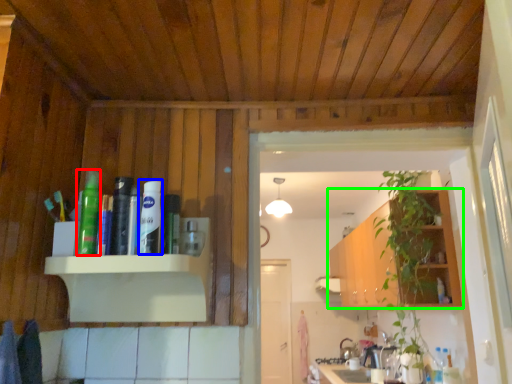
Question: Estimate the real-world distances between objects in this image. Which object is farther from toiletry (highlighted by a red box), toiletry (highlighted by a blue box) or cabinetry (highlighted by a green box)?

Choices:
 (A) toiletry
 (B) cabinetry

Answer: (B)